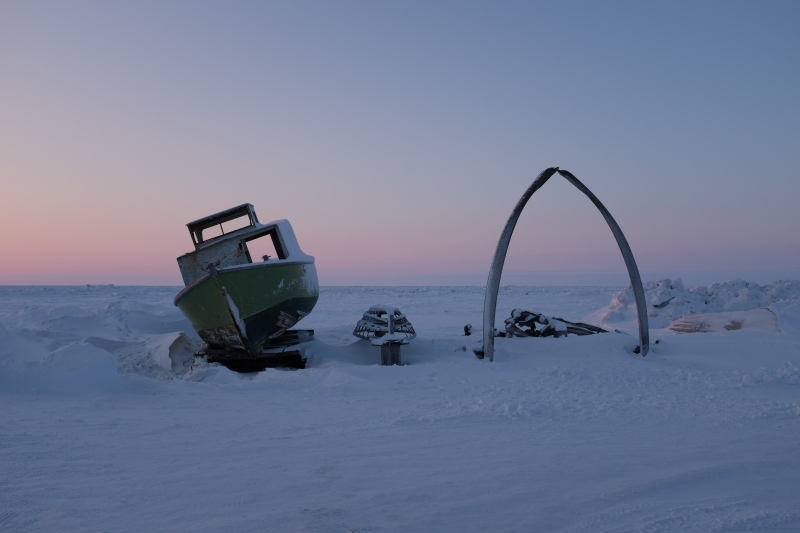
At what (x,y) coordinates should I click in order to perform the action: click on window. Please return your answer as a coordinate pair (x, y). The width and height of the screenshot is (800, 533). Looking at the image, I should click on (254, 252).